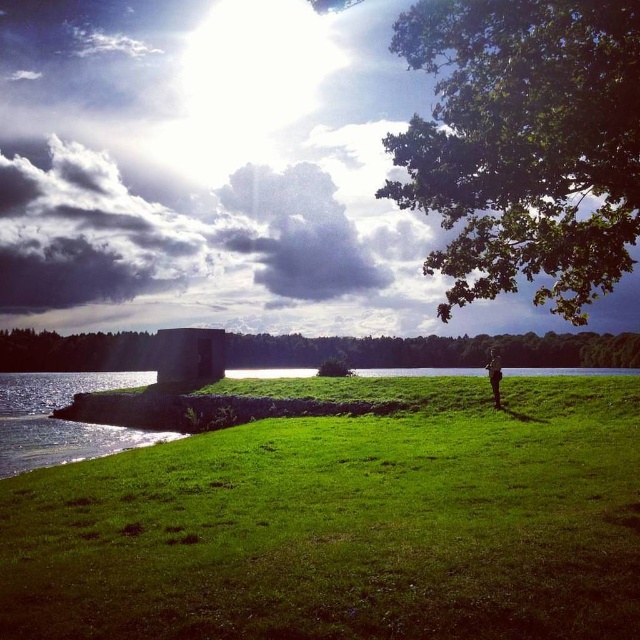
Does green grassy at center lie in front of green leafy tree at upper right?

Yes, it is in front of green leafy tree at upper right.

Does green grassy at center appear over green leafy tree at upper right?

Actually, green grassy at center is below green leafy tree at upper right.

Which is in front, point (365, 394) or point (563, 161)?

Point (563, 161) is in front.

At what (x,y) coordinates should I click in order to perform the action: click on green grassy at center. Please return your answer as a coordinate pair (x, y). Looking at the image, I should click on (346, 522).

Is green grassy at center bigger than green fabric jacket at center?

Result: Correct, green grassy at center is larger in size than green fabric jacket at center.

Is green grassy at center to the left of green fabric jacket at center from the viewer's perspective?

Indeed, green grassy at center is positioned on the left side of green fabric jacket at center.

The image size is (640, 640). Find the location of `green grassy at center`. green grassy at center is located at coordinates (346, 522).

Which is more to the left, green leafy tree at upper right or green fabric jacket at center?

From the viewer's perspective, green fabric jacket at center appears more on the left side.

Can you confirm if green leafy tree at upper right is wider than green fabric jacket at center?

Yes, green leafy tree at upper right is wider than green fabric jacket at center.

I want to click on green leafy tree at upper right, so click(524, 144).